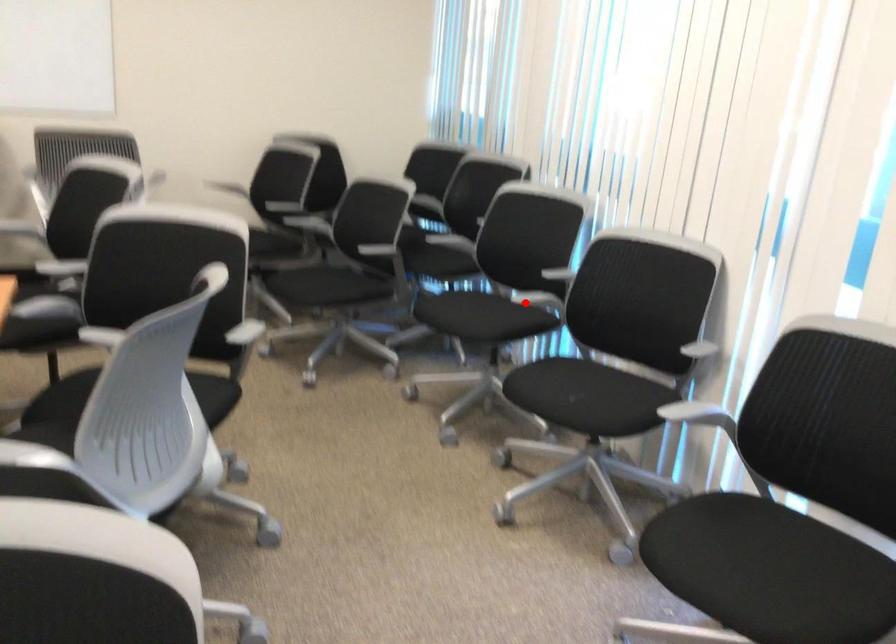
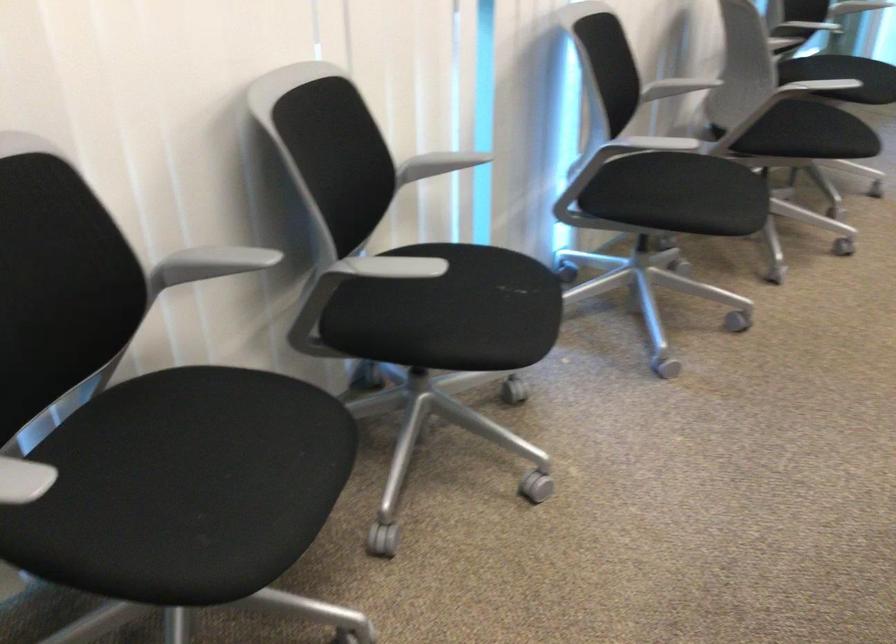
Question: I am providing you with two images of the same scene from different viewpoints. Image1 has a red point marked. In image2, the corresponding 3D location appears at what relative position? Reply with the corresponding letter.

Choices:
 (A) Closer
 (B) Farther

Answer: (A)